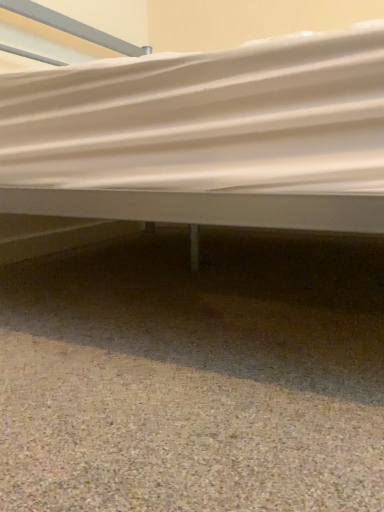
In the scene shown: In order to face white fabric bed at center, should I rotate leftwards or rightwards?

To face it directly, rotate left by 0.554 degrees.

At what (x,y) coordinates should I click in order to perform the action: click on white fabric bed at center. Please return your answer as a coordinate pair (x, y). The image size is (384, 512). Looking at the image, I should click on (205, 136).

What do you see at coordinates (205, 136) in the screenshot?
I see `white fabric bed at center` at bounding box center [205, 136].

Locate an element on the screen. brown gravel at lower center is located at coordinates (173, 438).

The width and height of the screenshot is (384, 512). What do you see at coordinates (173, 438) in the screenshot?
I see `brown gravel at lower center` at bounding box center [173, 438].

Where is `white fabric bed at center`? The height and width of the screenshot is (512, 384). white fabric bed at center is located at coordinates (205, 136).

Considering the positions of objects brown gravel at lower center and white fabric bed at center in the image provided, who is more to the right, brown gravel at lower center or white fabric bed at center?

white fabric bed at center is more to the right.

Is brown gravel at lower center in front of white fabric bed at center?

Yes, the depth of brown gravel at lower center is less than that of white fabric bed at center.

Is point (324, 506) closer to viewer compared to point (227, 184)?

Yes, point (324, 506) is in front of point (227, 184).

From the image's perspective, which is above, brown gravel at lower center or white fabric bed at center?

white fabric bed at center.

From a real-world perspective, is brown gravel at lower center located higher than white fabric bed at center?

No, from a real-world perspective, brown gravel at lower center is not above white fabric bed at center.

Between brown gravel at lower center and white fabric bed at center, which one has smaller width?

Thinner between the two is brown gravel at lower center.

From their relative heights in the image, would you say brown gravel at lower center is taller or shorter than white fabric bed at center?

Considering their sizes, brown gravel at lower center has less height than white fabric bed at center.

Does brown gravel at lower center have a larger size compared to white fabric bed at center?

Incorrect, brown gravel at lower center is not larger than white fabric bed at center.

Would you say brown gravel at lower center is inside or outside white fabric bed at center?

brown gravel at lower center is not inside white fabric bed at center, it's outside.

Is brown gravel at lower center not near white fabric bed at center?

brown gravel at lower center is near white fabric bed at center, not far away.

Is brown gravel at lower center turned away from white fabric bed at center?

brown gravel at lower center is not turned away from white fabric bed at center.

The image size is (384, 512). In order to click on bed that appears above the brown gravel at lower center (from the image's perspective) in this screenshot , I will do click(205, 136).

From the picture: Is white fabric bed at center to the left of brown gravel at lower center from the viewer's perspective?

No.

Is the position of white fabric bed at center less distant than that of brown gravel at lower center?

That is False.

Which point is more forward, (129, 106) or (117, 423)?

The point (117, 423) is more forward.

From the image's perspective, is white fabric bed at center above or below brown gravel at lower center?

white fabric bed at center is above brown gravel at lower center.

From a real-world perspective, is white fabric bed at center on brown gravel at lower center?

A: Yes, from a real-world perspective, white fabric bed at center is above brown gravel at lower center.

Considering the relative sizes of white fabric bed at center and brown gravel at lower center in the image provided, is white fabric bed at center thinner than brown gravel at lower center?

Incorrect, the width of white fabric bed at center is not less than that of brown gravel at lower center.

Between white fabric bed at center and brown gravel at lower center, which one has more height?

white fabric bed at center.

Who is bigger, white fabric bed at center or brown gravel at lower center?

white fabric bed at center is bigger.

Is white fabric bed at center outside of brown gravel at lower center?

Absolutely, white fabric bed at center is external to brown gravel at lower center.

Does white fabric bed at center touch brown gravel at lower center?

No, white fabric bed at center is not making contact with brown gravel at lower center.

Is white fabric bed at center oriented towards brown gravel at lower center?

No, white fabric bed at center does not turn towards brown gravel at lower center.

The image size is (384, 512). Find the location of `bed above the brown gravel at lower center (from a real-world perspective)`. bed above the brown gravel at lower center (from a real-world perspective) is located at coordinates (205, 136).

The image size is (384, 512). Identify the location of gravel below the white fabric bed at center (from the image's perspective). (173, 438).

Where is `bed that is above the brown gravel at lower center (from a real-world perspective)`? This screenshot has height=512, width=384. bed that is above the brown gravel at lower center (from a real-world perspective) is located at coordinates (205, 136).